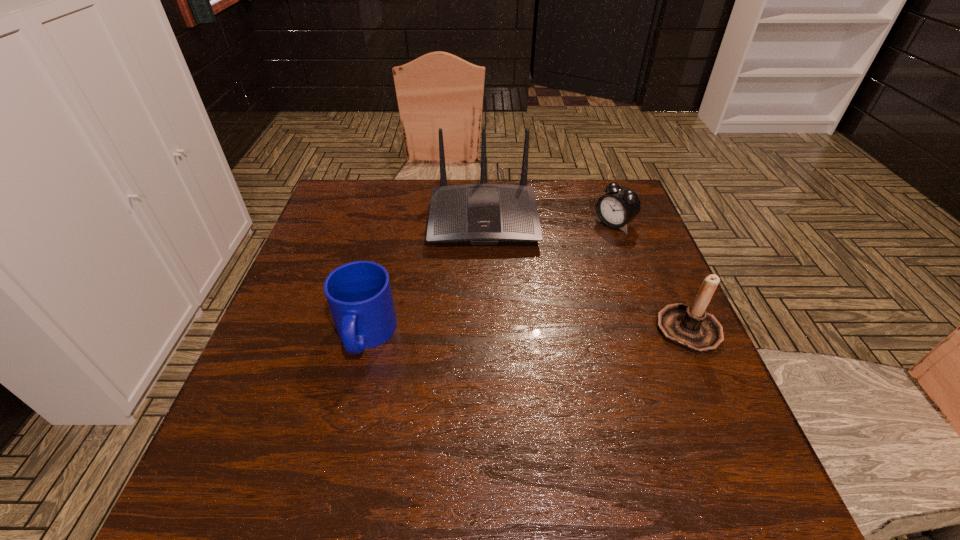
Where is `free point at the near edge`? Image resolution: width=960 pixels, height=540 pixels. free point at the near edge is located at coordinates (613, 407).

Identify the location of vacant space at the left edge of the desktop. The height and width of the screenshot is (540, 960). (302, 278).

You are a GUI agent. You are given a task and a screenshot of the screen. Output one action in this format:
    pyautogui.click(x=<x>, y=<y>)
    Task: Click on the vacant space at the right edge
    
    Given the screenshot: What is the action you would take?
    pyautogui.click(x=666, y=354)

Image resolution: width=960 pixels, height=540 pixels. I want to click on free space at the far left corner of the desktop, so click(367, 205).

The height and width of the screenshot is (540, 960). In order to click on vacant region at the near left corner of the desktop in this screenshot , I will do `click(259, 423)`.

The image size is (960, 540). Identify the location of vacant space in between the candle holder and the alarm clock. (651, 276).

At what (x,y) coordinates should I click in order to perform the action: click on free spot between the alarm clock and the second object from left to right. Please return your answer as a coordinate pair (x, y). This screenshot has height=540, width=960. Looking at the image, I should click on (549, 221).

In order to click on vacant area between the second tallest object and the tallest object in this screenshot , I will do `click(586, 274)`.

Where is `blank region between the alarm clock and the tallest object`? The width and height of the screenshot is (960, 540). blank region between the alarm clock and the tallest object is located at coordinates (549, 221).

This screenshot has width=960, height=540. Identify the location of blank region between the second tallest object and the third object from right to left. (586, 274).